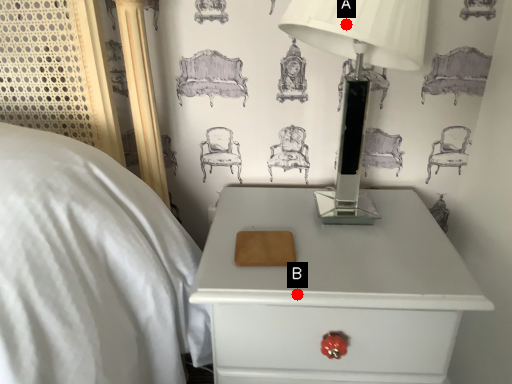
Question: Two points are circled on the image, labeled by A and B beside each circle. Which point is further to the camera?

Choices:
 (A) A is further
 (B) B is further

Answer: (B)